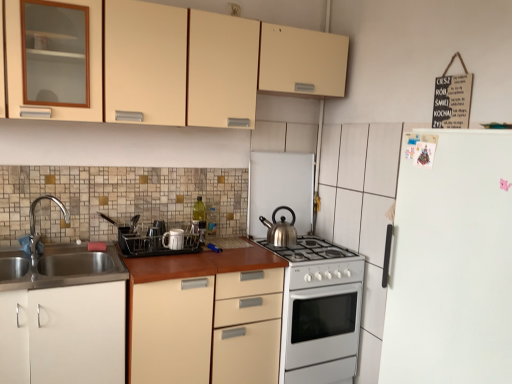
The height and width of the screenshot is (384, 512). In order to click on vacant area that is situated to the right of matte plastic dish rack at center, which is the first appliance in left-to-right order in this screenshot , I will do `click(185, 254)`.